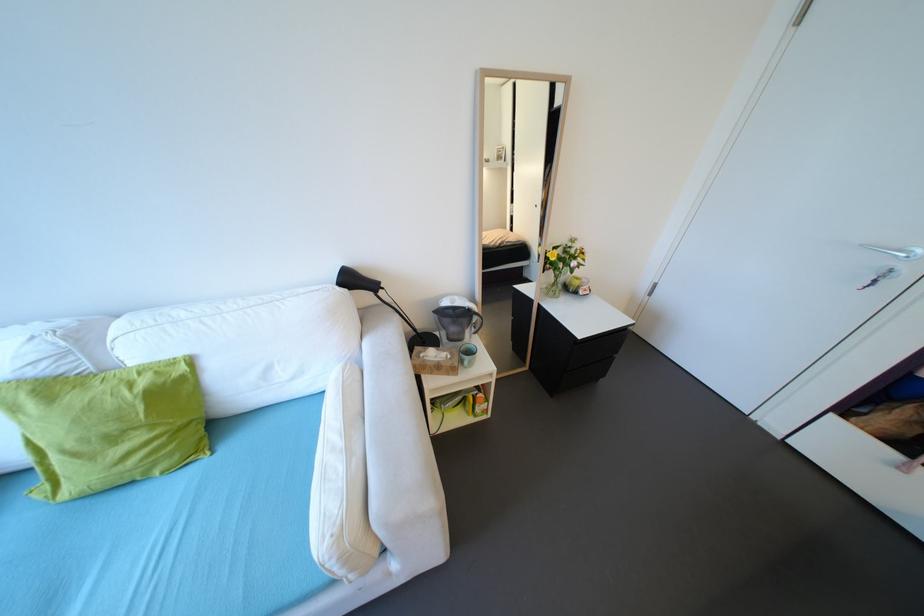
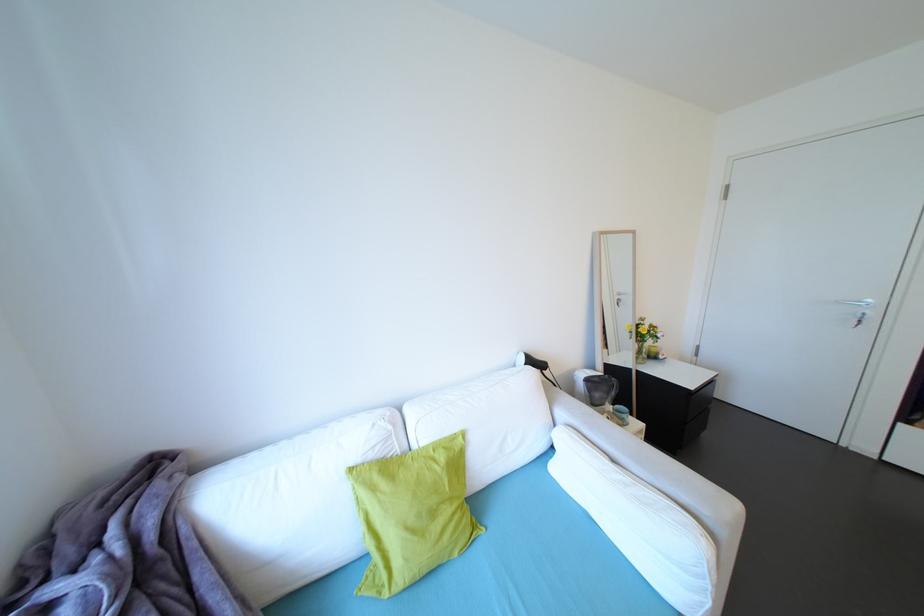
The point at (562, 288) is marked in the first image. Where is the corresponding point in the second image?

(648, 355)